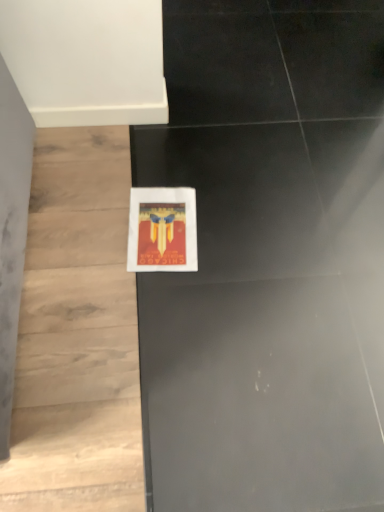
You are a GUI agent. You are given a task and a screenshot of the screen. Output one action in this format:
    pyautogui.click(x=<x>, y=<y>)
    Task: Click on the free location in front of matte paper picture frame at center
    
    Given the screenshot: What is the action you would take?
    pyautogui.click(x=150, y=303)